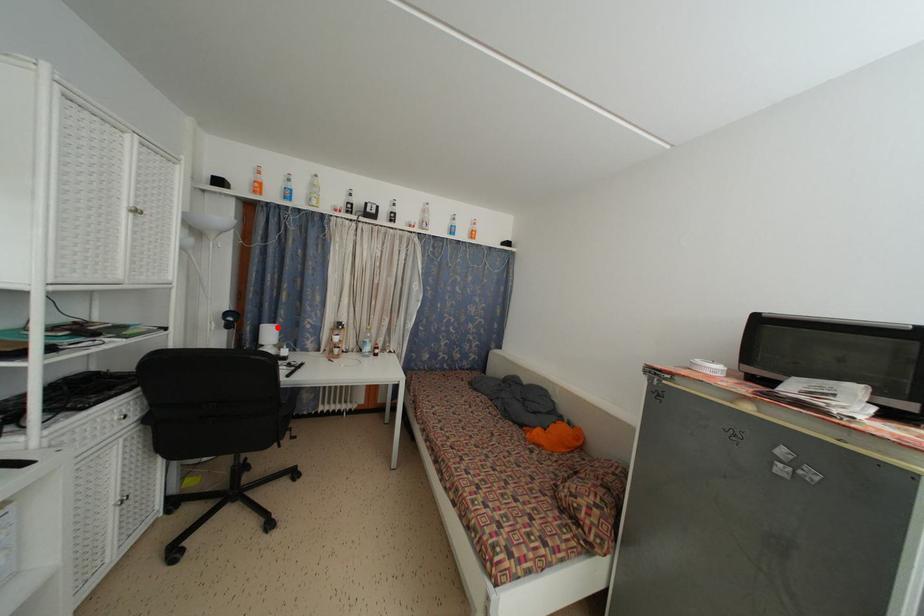
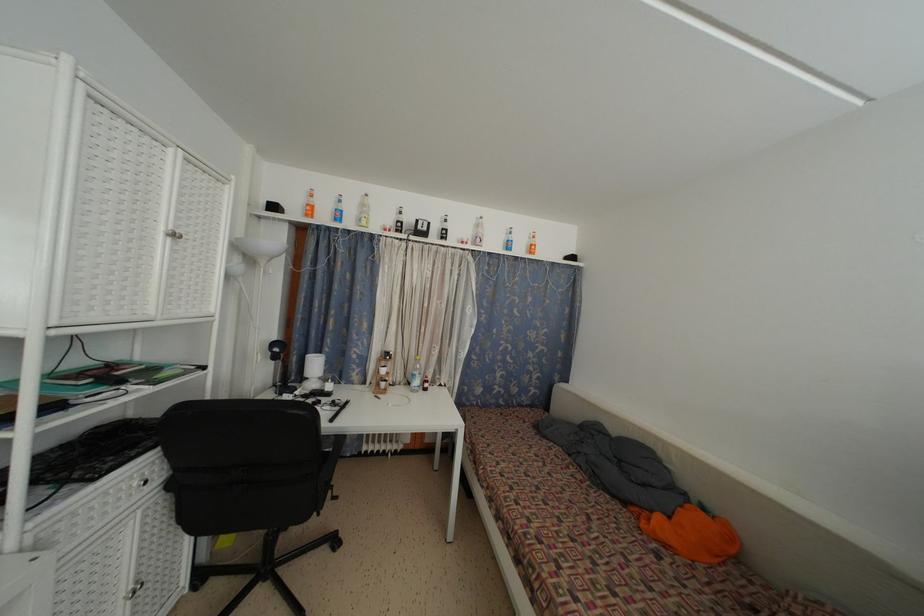
In the second image, find the point that corresponds to the highlighted location in the first image.

(323, 357)